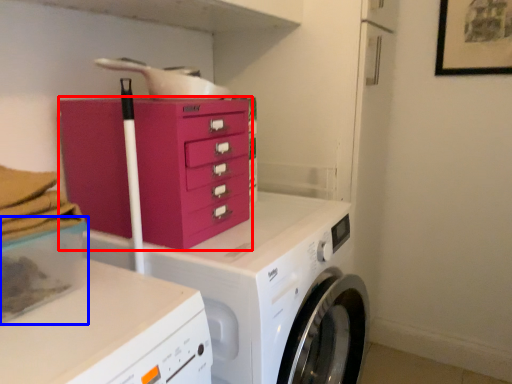
Question: Which object appears farthest to the camera in this image, chest of drawers (highlighted by a red box) or storage box (highlighted by a blue box)?

Choices:
 (A) chest of drawers
 (B) storage box

Answer: (A)